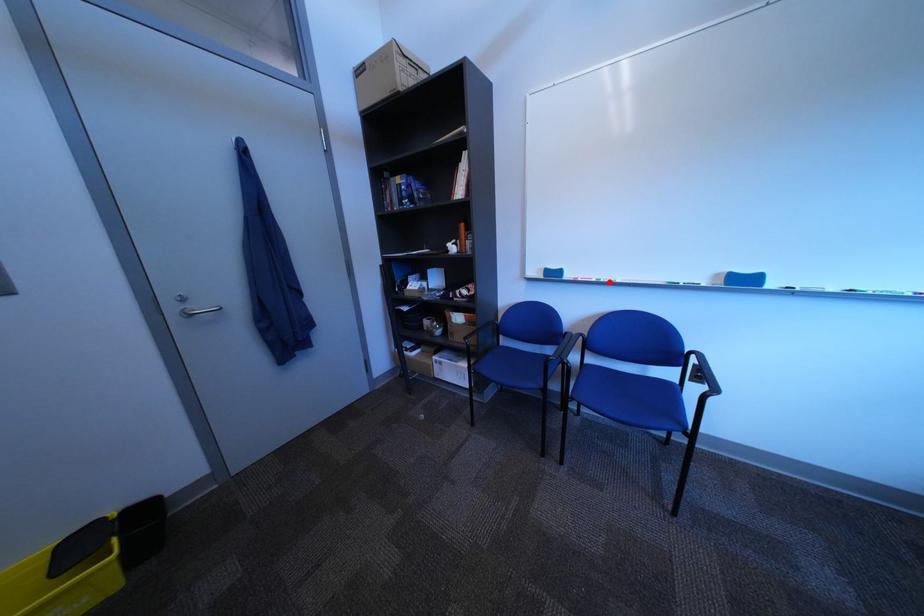
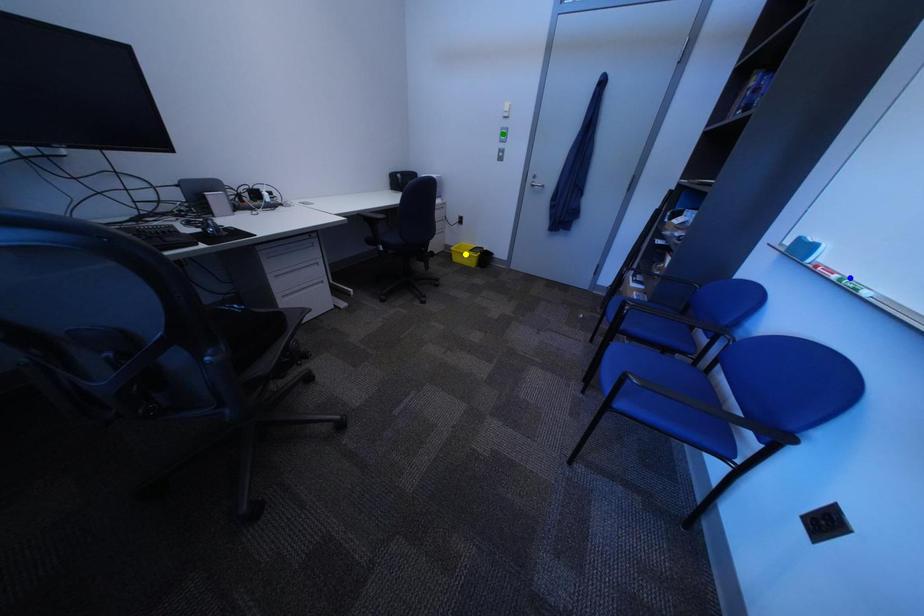
Question: I am providing you with two images of the same scene from different viewpoints. A red point is marked on the first image. You are given multiple points on the second image. In image 2, which mark is for the same physical point as the one in image 1?

Choices:
 (A) blue point
 (B) yellow point
 (C) green point

Answer: (A)